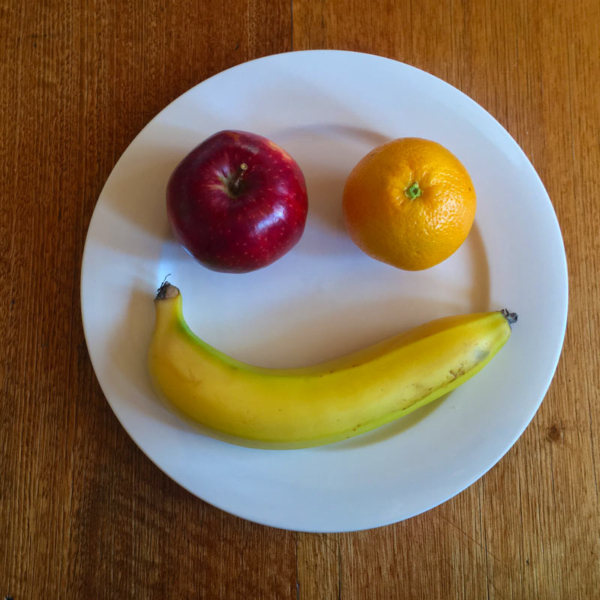
Image resolution: width=600 pixels, height=600 pixels. Identify the location of darker part of the wood. (553, 438).